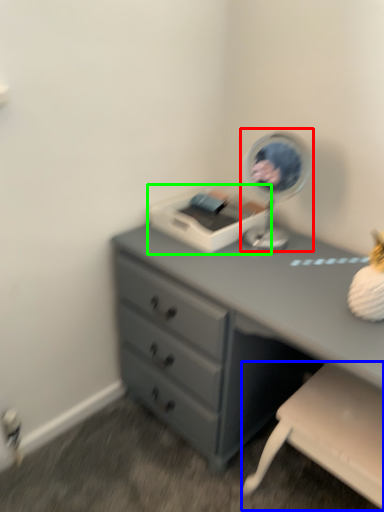
Question: Which object is the closest to the table lamp (highlighted by a red box)? Choose among these: swivel chair (highlighted by a blue box) or printer (highlighted by a green box).

Choices:
 (A) swivel chair
 (B) printer

Answer: (B)